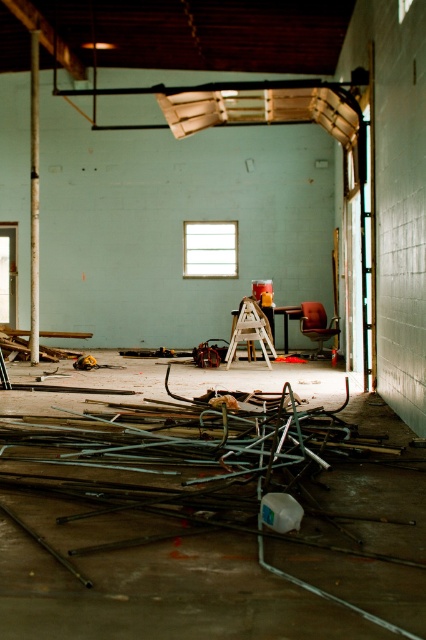
Who is shorter, matte white beam at left or leatherette office chair at center?

With less height is leatherette office chair at center.

Can you confirm if matte white beam at left is shorter than leatherette office chair at center?

No.

Find the location of a particular element. The image size is (426, 640). matte white beam at left is located at coordinates (34, 198).

Identify the location of matte white beam at left. (34, 198).

How far apart are metallic gray metal at center and matte white beam at left?

metallic gray metal at center and matte white beam at left are 8.35 meters apart.

Can you confirm if metallic gray metal at center is positioned to the right of matte white beam at left?

Yes, metallic gray metal at center is to the right of matte white beam at left.

Locate an element on the screen. This screenshot has width=426, height=640. metallic gray metal at center is located at coordinates (201, 522).

Locate an element on the screen. The width and height of the screenshot is (426, 640). metallic gray metal at center is located at coordinates (201, 522).

Can you confirm if metallic gray metal at center is thinner than leatherette office chair at center?

No.

Find the location of a particular element. This screenshot has height=640, width=426. metallic gray metal at center is located at coordinates (201, 522).